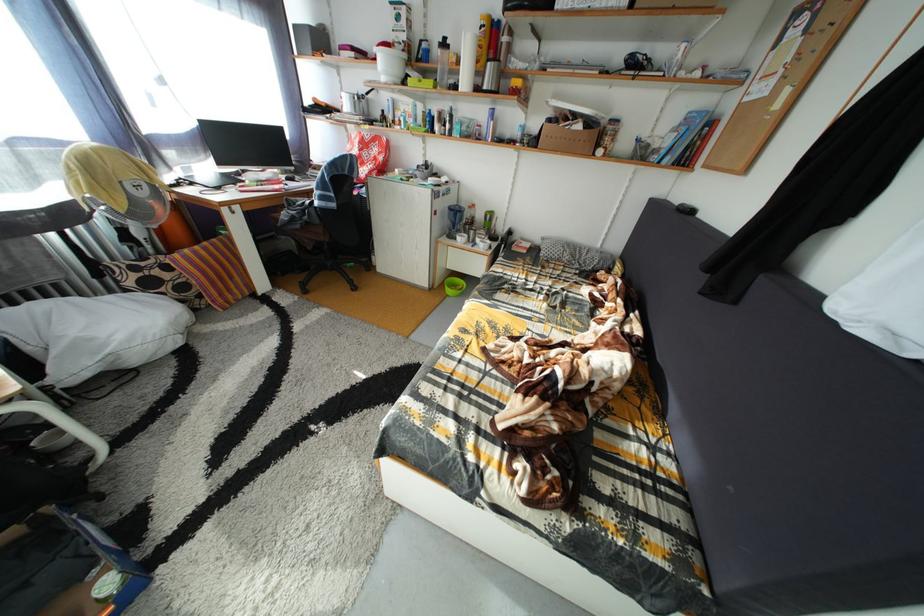
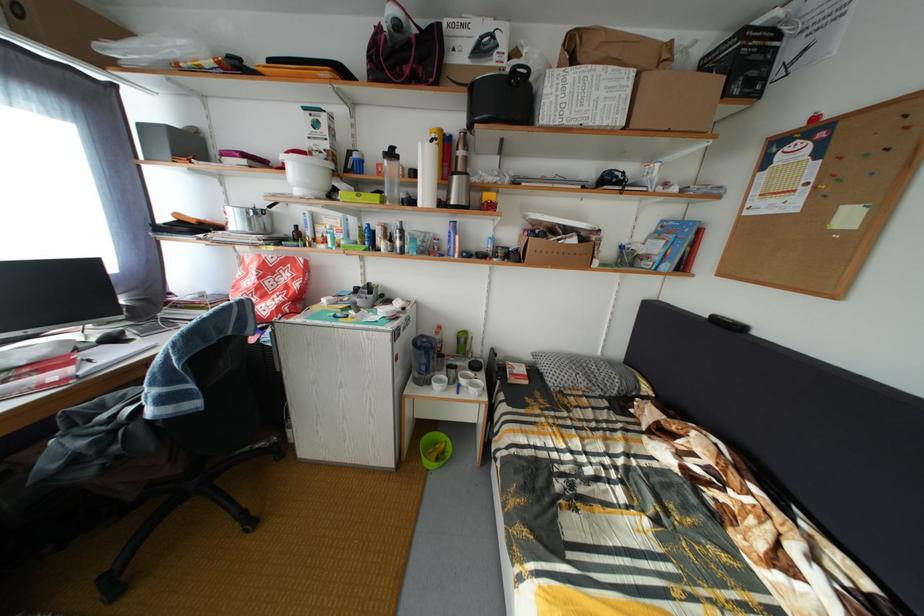
In the second image, find the point that corresponds to (377,144) in the first image.

(281, 267)